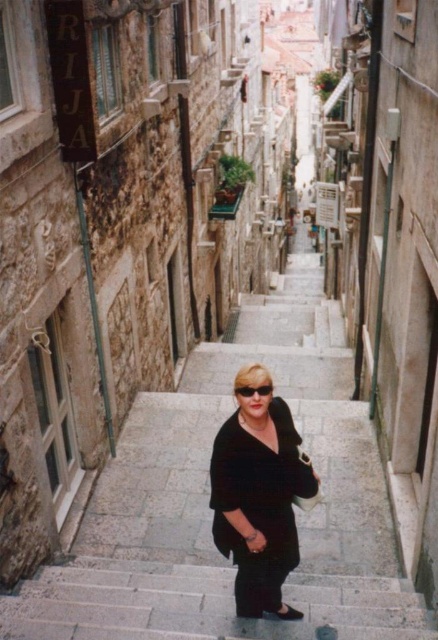
You are a delivery person carrying a package that requires a 1.5 meter clearance to maneuver safely. You are standing at the bottom of the staircase and see the black matte dress at center and the black leather sandal at center in the middle of the staircase. Can you safely navigate through the space between them with your package?

The black matte dress at center is 1.04 meters away from the black leather sandal at center. Since the required clearance is 1.5 meters, the distance is insufficient. You cannot safely navigate through the space between them with your package.

You are standing at the bottom of the narrow stone staircase in the historic European setting. You notice a point marked at coordinates (x=208, y=500). What does this point indicate?

The point at coordinates (x=208, y=500) corresponds to the smooth stone stairs at center, indicating their central location in the scene.